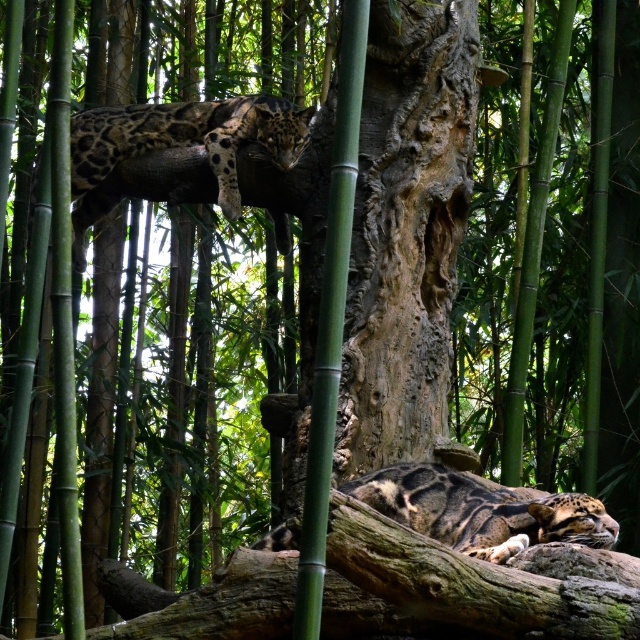
Question: Which of the following is the farthest from the observer?

Choices:
 (A) (404, 236)
 (B) (150, 116)
 (C) (467, 477)

Answer: (B)

Question: Where is rough bark tree trunk at center located in relation to clouded leopard at upper left in the image?

Choices:
 (A) right
 (B) left

Answer: (A)

Question: Which object is the closest to the clouded leopard at lower center?

Choices:
 (A) rough bark tree trunk at center
 (B) clouded leopard at upper left

Answer: (A)

Question: Which of the following is the closest to the observer?

Choices:
 (A) (522, 512)
 (B) (230, 180)

Answer: (A)

Question: Is rough bark tree trunk at center behind clouded leopard at upper left?

Choices:
 (A) no
 (B) yes

Answer: (A)

Question: Does rough bark tree trunk at center have a greater width compared to clouded leopard at upper left?

Choices:
 (A) yes
 (B) no

Answer: (B)